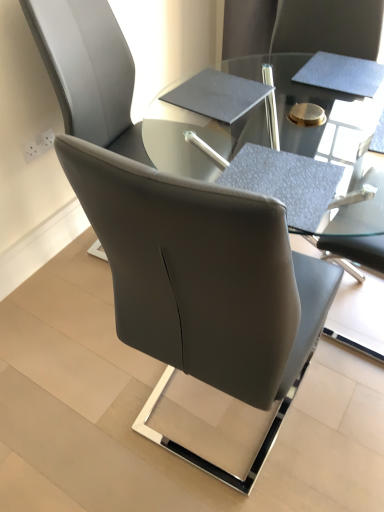
What is the approximate width of matte gray table at center?

22.48 inches.

The height and width of the screenshot is (512, 384). What do you see at coordinates (204, 284) in the screenshot? I see `satin black chair at center` at bounding box center [204, 284].

Where is `satin black chair at center`? satin black chair at center is located at coordinates (204, 284).

Image resolution: width=384 pixels, height=512 pixels. What do you see at coordinates (341, 74) in the screenshot?
I see `textured gray notepad at upper right` at bounding box center [341, 74].

Where is `matte gray table at center`? This screenshot has height=512, width=384. matte gray table at center is located at coordinates (337, 159).

Is there a large distance between matte gray table at center and satin black chair at center?

No, matte gray table at center is in close proximity to satin black chair at center.

Considering the relative sizes of matte gray table at center and satin black chair at center in the image provided, is matte gray table at center shorter than satin black chair at center?

No.

Which object is positioned more to the left, matte gray table at center or satin black chair at center?

satin black chair at center is more to the left.

Does matte gray table at center have a smaller size compared to satin black chair at center?

Actually, matte gray table at center might be larger than satin black chair at center.

Considering the relative positions of satin black chair at center and textured gray notepad at upper right in the image provided, is satin black chair at center to the left of textured gray notepad at upper right from the viewer's perspective?

Yes, satin black chair at center is to the left of textured gray notepad at upper right.

Is point (278, 383) behind point (346, 73)?

That is False.

From a real-world perspective, relative to textured gray notepad at upper right, is satin black chair at center vertically above or below?

In terms of real-world spatial position, satin black chair at center is below textured gray notepad at upper right.

Based on the photo, is satin black chair at center aimed at textured gray notepad at upper right?

No, satin black chair at center is not aimed at textured gray notepad at upper right.

Is satin black chair at center placed right next to black matte notebook at center?

satin black chair at center is not next to black matte notebook at center, and they're not touching.

You are a GUI agent. You are given a task and a screenshot of the screen. Output one action in this format:
    pyautogui.click(x=<x>, y=<y>)
    Task: Click on the chair below the black matte notebook at center (from a real-world perspective)
    
    Given the screenshot: What is the action you would take?
    pyautogui.click(x=204, y=284)

Looking at this image, between satin black chair at center and black matte notebook at center, which one has larger size?

satin black chair at center.

Does satin black chair at center have a lesser width compared to black matte notebook at center?

No.

Based on the photo, is matte gray table at center oriented towards black matte notebook at center?

Yes, matte gray table at center is oriented towards black matte notebook at center.

How distant is matte gray table at center from black matte notebook at center?

matte gray table at center and black matte notebook at center are 9.27 inches apart from each other.

Are matte gray table at center and black matte notebook at center beside each other?

matte gray table at center is not next to black matte notebook at center, and they're not touching.

Considering the relative sizes of matte gray table at center and black matte notebook at center in the image provided, is matte gray table at center smaller than black matte notebook at center?

Incorrect, matte gray table at center is not smaller in size than black matte notebook at center.

From a real-world perspective, is black matte notebook at center physically located above or below textured gray notepad at upper right?

Clearly, from a real-world perspective, black matte notebook at center is below textured gray notepad at upper right.

Between black matte notebook at center and textured gray notepad at upper right, which one appears on the right side from the viewer's perspective?

From the viewer's perspective, textured gray notepad at upper right appears more on the right side.

Considering the sizes of black matte notebook at center and textured gray notepad at upper right in the image, is black matte notebook at center bigger or smaller than textured gray notepad at upper right?

Clearly, black matte notebook at center is smaller in size than textured gray notepad at upper right.

Is black matte notebook at center taller than textured gray notepad at upper right?

Yes, black matte notebook at center is taller than textured gray notepad at upper right.

Is black matte notebook at center oriented away from matte gray table at center?

No.

Considering the relative sizes of black matte notebook at center and matte gray table at center in the image provided, is black matte notebook at center shorter than matte gray table at center?

Yes.

From the image's perspective, does matte gray table at center appear lower than textured gray notepad at upper right?

Yes, from the image's perspective, matte gray table at center is below textured gray notepad at upper right.

Is matte gray table at center wider than textured gray notepad at upper right?

Yes, matte gray table at center is wider than textured gray notepad at upper right.

Is matte gray table at center taller or shorter than textured gray notepad at upper right?

Clearly, matte gray table at center is taller compared to textured gray notepad at upper right.

This screenshot has height=512, width=384. I want to click on chair below the matte gray table at center (from a real-world perspective), so click(x=204, y=284).

This screenshot has height=512, width=384. Find the location of `chair that appears on the left of textured gray notepad at upper right`. chair that appears on the left of textured gray notepad at upper right is located at coordinates (204, 284).

Which object lies nearer to the anchor point satin black chair at center, textured gray notepad at upper right or black matte notebook at center?

Based on the image, black matte notebook at center appears to be nearer to satin black chair at center.

Estimate the real-world distances between objects in this image. Which object is further from black matte notebook at center, satin black chair at center or textured gray notepad at upper right?

The object further to black matte notebook at center is satin black chair at center.

Considering their positions, is black matte notebook at center positioned further to textured gray notepad at upper right than satin black chair at center?

satin black chair at center is further to textured gray notepad at upper right.

When comparing their distances from textured gray notepad at upper right, does satin black chair at center or matte gray table at center seem closer?

matte gray table at center.

From the image, which object appears to be farther from matte gray table at center, textured gray notepad at upper right or black matte notebook at center?

black matte notebook at center is further to matte gray table at center.

When comparing their distances from satin black chair at center, does textured gray notepad at upper right or matte gray table at center seem closer?

matte gray table at center is closer to satin black chair at center.

In the scene shown: Considering their positions, is textured gray notepad at upper right positioned closer to black matte notebook at center than matte gray table at center?

matte gray table at center lies closer to black matte notebook at center than the other object.

Which object lies further to the anchor point matte gray table at center, satin black chair at center or black matte notebook at center?

satin black chair at center.

In order to click on notebook between matte gray table at center and satin black chair at center vertically in this screenshot , I will do [x=220, y=94].

In order to click on notebook that lies between textured gray notepad at upper right and satin black chair at center from top to bottom in this screenshot , I will do `click(220, 94)`.

The width and height of the screenshot is (384, 512). In order to click on table situated between black matte notebook at center and textured gray notepad at upper right from left to right in this screenshot , I will do `click(337, 159)`.

What are the coordinates of `table between textured gray notepad at upper right and satin black chair at center in the vertical direction` in the screenshot? It's located at (337, 159).